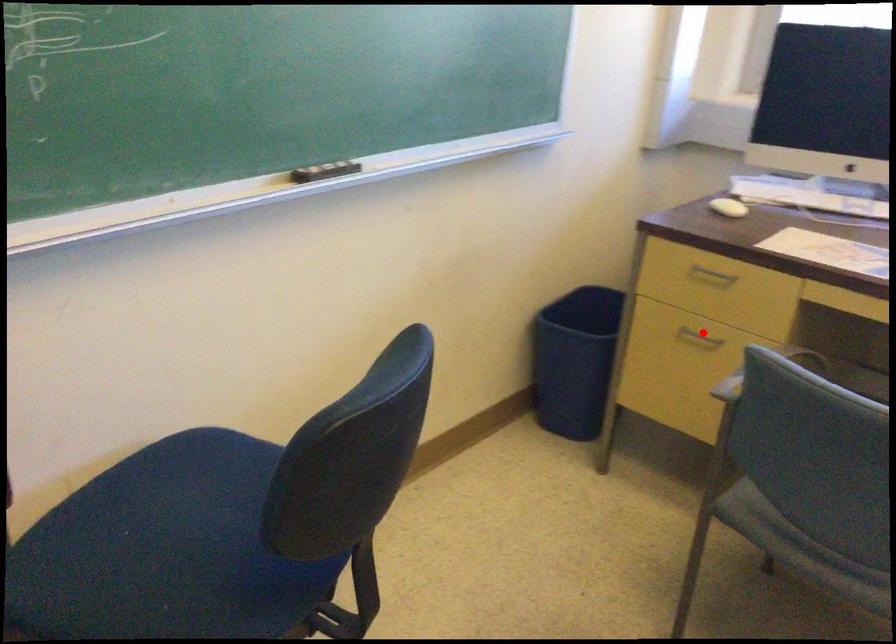
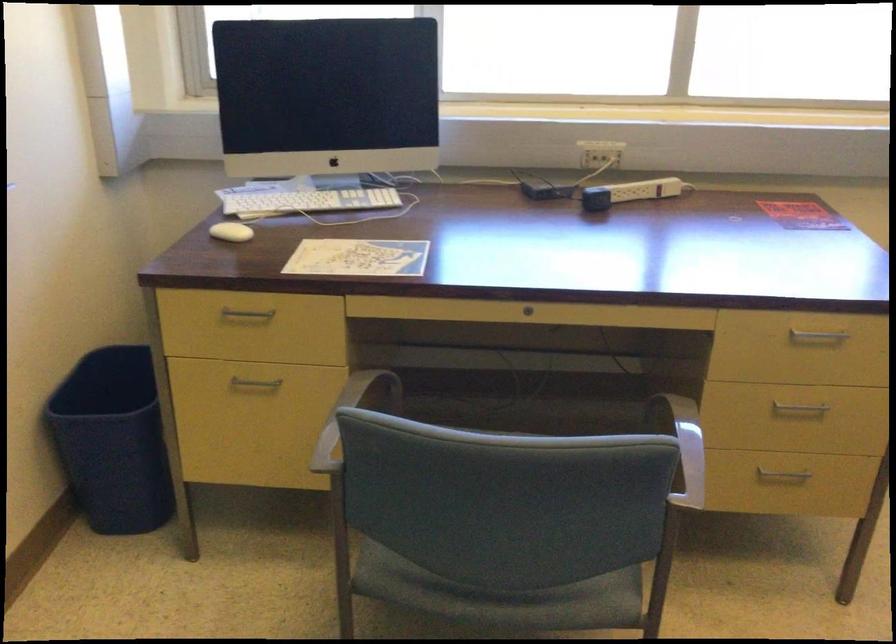
Question: I am providing you with two images of the same scene from different viewpoints. A red point is shown in image1. For the corresponding object point in image2, is it positioned nearer or farther from the camera?

Choices:
 (A) Nearer
 (B) Farther

Answer: (A)